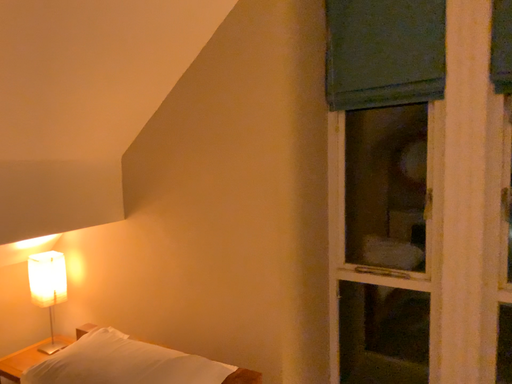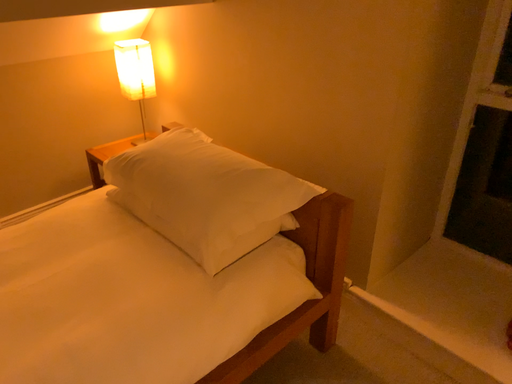
Question: How did the camera likely rotate when shooting the video?

Choices:
 (A) rotated left
 (B) rotated right

Answer: (A)